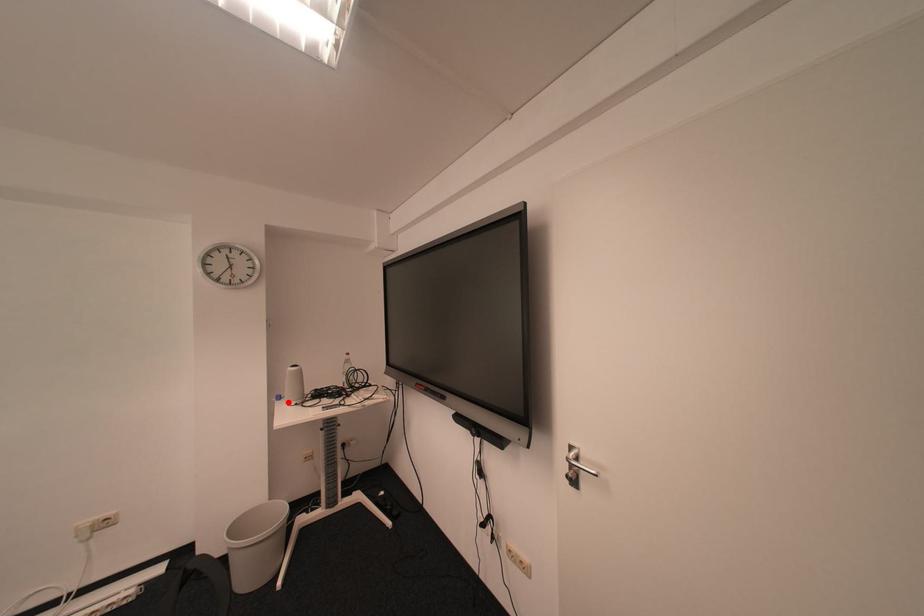
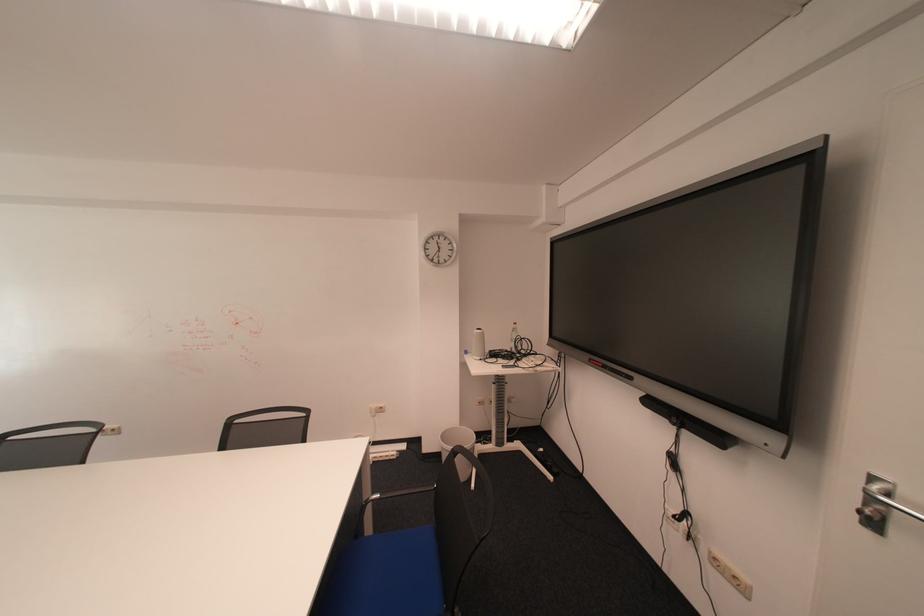
The point at the highlighted location is marked in the first image. Where is the corresponding point in the second image?

(477, 355)